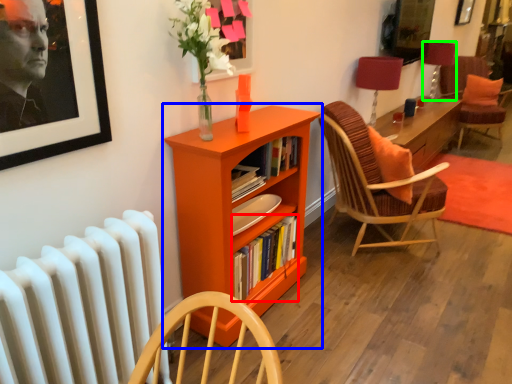
Question: Which is nearer to the book (highlighted by a red box)? bookcase (highlighted by a blue box) or table lamp (highlighted by a green box).

Choices:
 (A) bookcase
 (B) table lamp

Answer: (A)